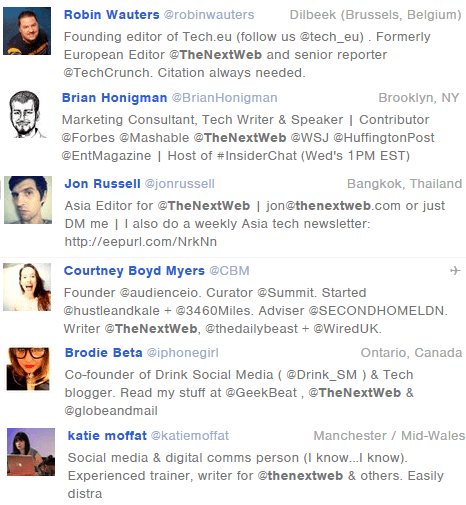
Locate an element on the screen. The image size is (466, 505). laptop is located at coordinates (26, 462).